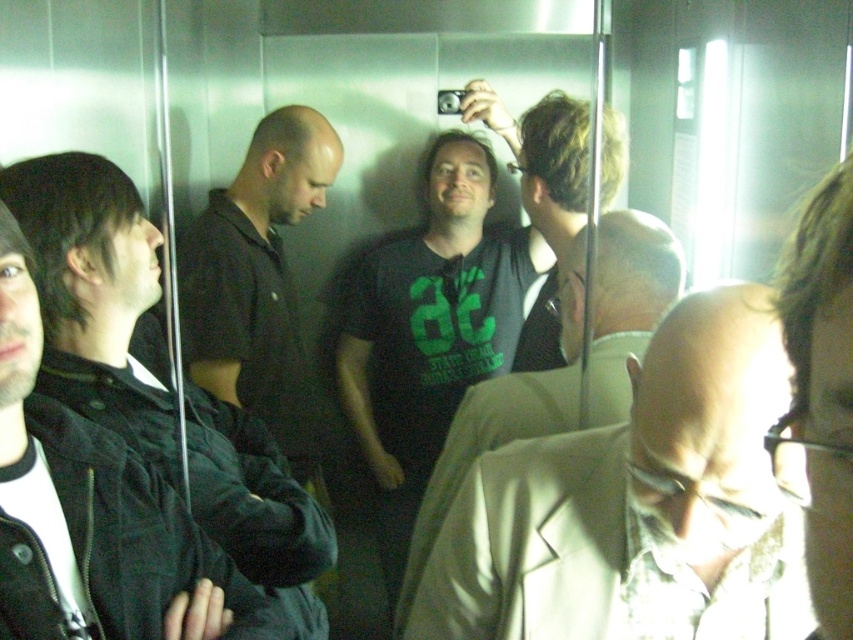
You are standing in an elevator and want to reach a button located at point (x=752, y=481). If your arm can extend 30 inches, will you be able to reach it?

The point (x=752, y=481) is 31.02 inches away from the camera, so your arm can not reach it since it is slightly further than 30 inches.

You are standing in the elevator and want to hand a document to the person in the light beige suit at center and the black matte shirt at left. Which person should you approach first to ensure you can reach them without moving further into the elevator?

You should approach the light beige suit at center first because they are closer to you than the black matte shirt at left, so you can reach them without moving further into the elevator.

You are standing in the elevator described in the scene. You notice a light beige suit at center located at point (640, 504). If you want to move towards the light beige suit at center, which direction should you face?

You should face towards the center of the elevator to move towards the light beige suit at center located at point (640, 504).